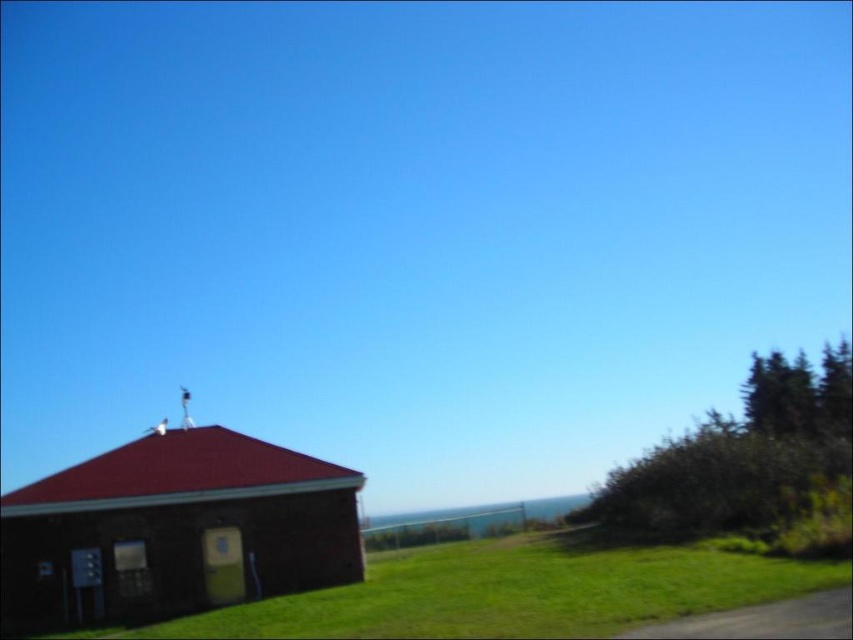
Between brick-like brown hut at lower left and green grass at lower right, which one appears on the left side from the viewer's perspective?

brick-like brown hut at lower left is more to the left.

This screenshot has height=640, width=853. I want to click on brick-like brown hut at lower left, so click(175, 529).